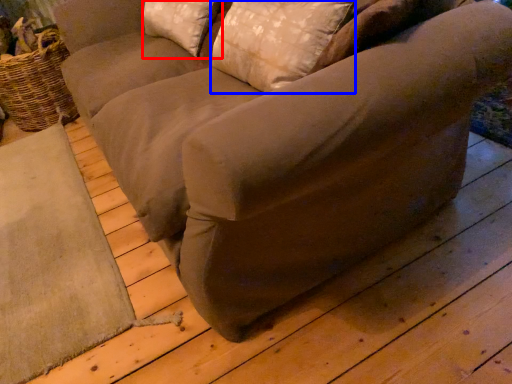
Question: Which point is further to the camera, pillow (highlighted by a red box) or pillow (highlighted by a blue box)?

Choices:
 (A) pillow
 (B) pillow

Answer: (A)